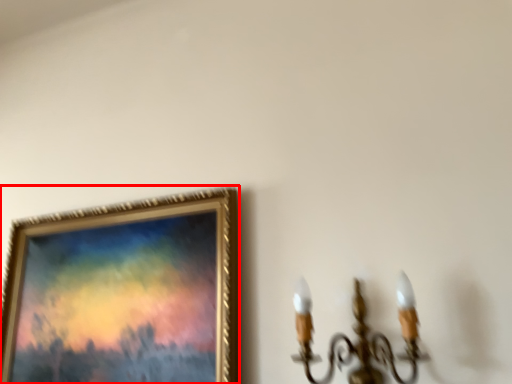
Question: Considering the relative positions of picture frame (annotated by the red box) and lamp in the image provided, where is picture frame (annotated by the red box) located with respect to the staircase?

Choices:
 (A) left
 (B) right

Answer: (A)